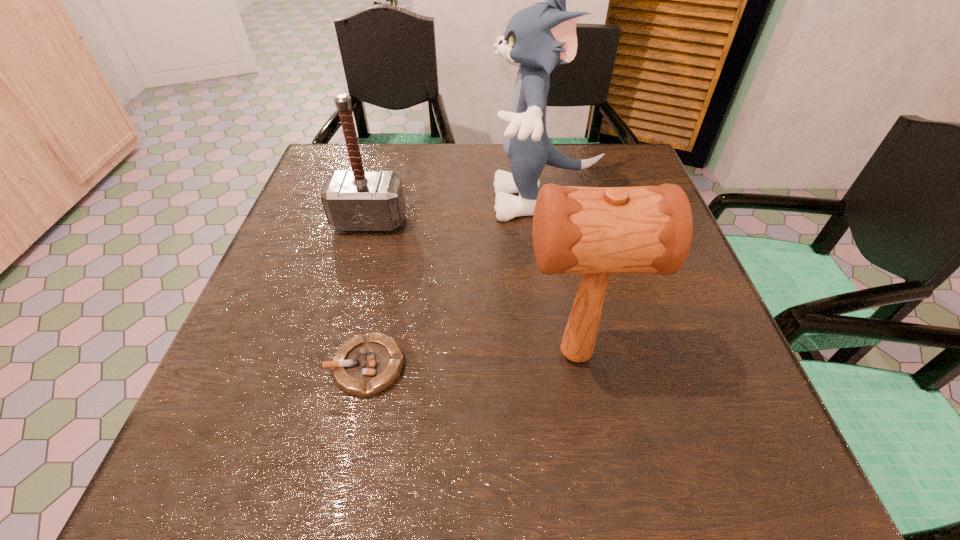
Locate an element on the screen. The image size is (960, 540). free point between the cat and the shortest object is located at coordinates (455, 284).

Identify the location of vacant area between the cat and the ashtray. coord(455,284).

At what (x,y) coordinates should I click in order to perform the action: click on empty space that is in between the hammer and the mallet. Please return your answer as a coordinate pair (x, y). Looking at the image, I should click on (472, 288).

Identify which object is located as the nearest to the mallet. Please provide its 2D coordinates. Your answer should be formatted as a tuple, i.e. [(x, y)], where the tuple contains the x and y coordinates of a point satisfying the conditions above.

[(537, 38)]

Where is `object that is the third closest to the shortest object`? The image size is (960, 540). object that is the third closest to the shortest object is located at coordinates (359, 200).

Find the location of a particular element. free spot that satisfies the following two spatial constraints: 1. on the front-facing side of the tallest object; 2. on the front side of the hammer is located at coordinates (547, 221).